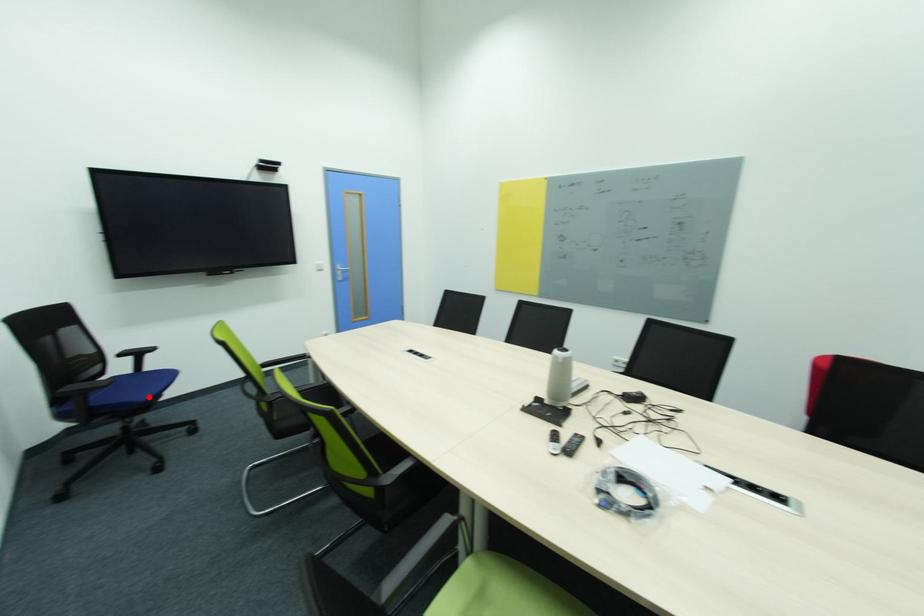
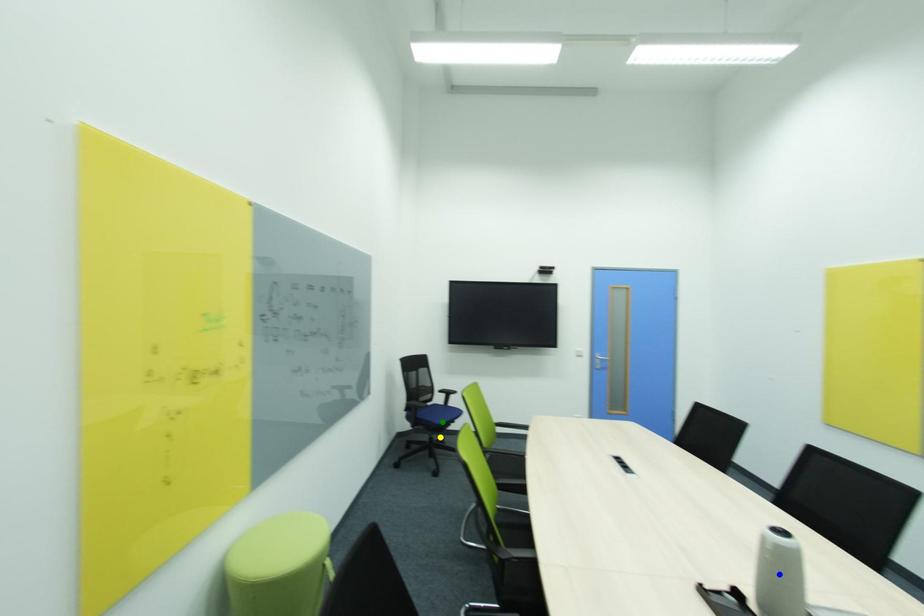
Question: I am providing you with two images of the same scene from different viewpoints. A red point is marked on the first image. You are given multiple points on the second image. Which point in image 2 represents the same 3d spot as the red point in image 1?

Choices:
 (A) blue point
 (B) yellow point
 (C) green point

Answer: (C)